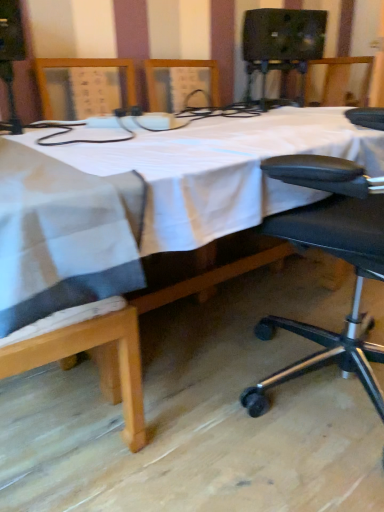
This screenshot has height=512, width=384. What do you see at coordinates (345, 354) in the screenshot? I see `white cloth-covered table at center` at bounding box center [345, 354].

This screenshot has width=384, height=512. Identify the location of white cloth-covered table at center. (345, 354).

The width and height of the screenshot is (384, 512). Find the location of `black fabric chair at lower right`. black fabric chair at lower right is located at coordinates (334, 255).

What do you see at coordinates (334, 255) in the screenshot?
I see `black fabric chair at lower right` at bounding box center [334, 255].

What is the approximate height of black fabric chair at lower right?

3.62 feet.

This screenshot has height=512, width=384. I want to click on white cloth-covered table at center, so click(x=345, y=354).

Visually, is white cloth-covered table at center positioned to the left or to the right of black fabric chair at lower right?

Based on their positions, white cloth-covered table at center is located to the left of black fabric chair at lower right.

Is white cloth-covered table at center behind black fabric chair at lower right?

No, white cloth-covered table at center is closer to the camera.

Does point (138, 375) come farther from viewer compared to point (376, 233)?

Yes, it is.

From the image's perspective, is white cloth-covered table at center positioned above or below black fabric chair at lower right?

white cloth-covered table at center is situated higher than black fabric chair at lower right in the image.

From a real-world perspective, is white cloth-covered table at center over black fabric chair at lower right?

No, from a real-world perspective, white cloth-covered table at center is not above black fabric chair at lower right.

Considering the sizes of objects white cloth-covered table at center and black fabric chair at lower right in the image provided, who is wider, white cloth-covered table at center or black fabric chair at lower right?

With larger width is white cloth-covered table at center.

Considering the relative sizes of white cloth-covered table at center and black fabric chair at lower right in the image provided, is white cloth-covered table at center shorter than black fabric chair at lower right?

Correct, white cloth-covered table at center is not as tall as black fabric chair at lower right.

Does white cloth-covered table at center have a larger size compared to black fabric chair at lower right?

Indeed, white cloth-covered table at center has a larger size compared to black fabric chair at lower right.

Is white cloth-covered table at center surrounding black fabric chair at lower right?

Yes, black fabric chair at lower right is inside white cloth-covered table at center.

Based on the photo, would you say white cloth-covered table at center is a long distance from black fabric chair at lower right?

No, white cloth-covered table at center is not far from black fabric chair at lower right.

Is white cloth-covered table at center looking in the opposite direction of black fabric chair at lower right?

Correct, white cloth-covered table at center is looking away from black fabric chair at lower right.

In the scene shown: What's the angular difference between white cloth-covered table at center and black fabric chair at lower right's facing directions?

The angular difference between white cloth-covered table at center and black fabric chair at lower right is 164 degrees.

How distant is white cloth-covered table at center from black fabric chair at lower right?

white cloth-covered table at center and black fabric chair at lower right are 18.48 inches apart from each other.

Identify the location of table that is in front of the black fabric chair at lower right. (345, 354).

Between black fabric chair at lower right and white cloth-covered table at center, which one appears on the right side from the viewer's perspective?

Positioned to the right is black fabric chair at lower right.

Considering their positions, is black fabric chair at lower right located in front of or behind white cloth-covered table at center?

black fabric chair at lower right is behind white cloth-covered table at center.

Which is more distant, [305,180] or [381,113]?

Positioned behind is point [381,113].

From the image's perspective, between black fabric chair at lower right and white cloth-covered table at center, who is located below?

From the image's view, black fabric chair at lower right is below.

From a real-world perspective, is black fabric chair at lower right positioned over white cloth-covered table at center based on gravity?

Yes, from a real-world perspective, black fabric chair at lower right is above white cloth-covered table at center.

Considering the relative sizes of black fabric chair at lower right and white cloth-covered table at center in the image provided, is black fabric chair at lower right thinner than white cloth-covered table at center?

Yes.

In terms of height, does black fabric chair at lower right look taller or shorter compared to white cloth-covered table at center?

Clearly, black fabric chair at lower right is taller compared to white cloth-covered table at center.

Does black fabric chair at lower right have a larger size compared to white cloth-covered table at center?

No.

Choose the correct answer: Is black fabric chair at lower right inside white cloth-covered table at center or outside it?

black fabric chair at lower right is contained in white cloth-covered table at center.

Based on the photo, is black fabric chair at lower right not close to white cloth-covered table at center?

They are positioned close to each other.

Is black fabric chair at lower right facing away from white cloth-covered table at center?

black fabric chair at lower right does not have its back to white cloth-covered table at center.

Can you tell me how much black fabric chair at lower right and white cloth-covered table at center differ in facing direction?

They differ by 164 degrees in their facing directions.

You are a GUI agent. You are given a task and a screenshot of the screen. Output one action in this format:
    pyautogui.click(x=<x>, y=<y>)
    Task: Click on the table located on the left of black fabric chair at lower right
    
    Given the screenshot: What is the action you would take?
    pyautogui.click(x=345, y=354)

What are the coordinates of `table in front of the black fabric chair at lower right` in the screenshot? It's located at (345, 354).

The height and width of the screenshot is (512, 384). In order to click on chair above the white cloth-covered table at center (from a real-world perspective) in this screenshot , I will do `click(334, 255)`.